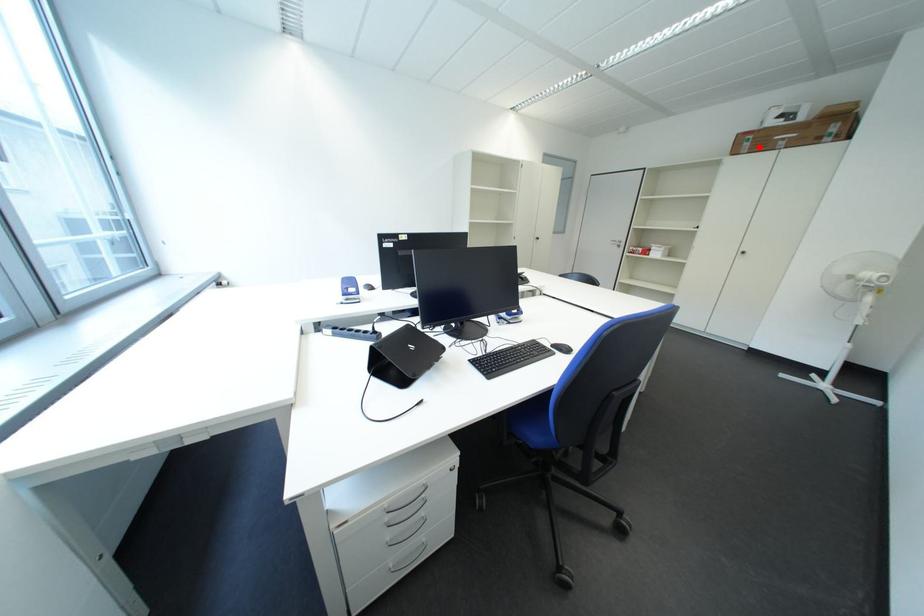
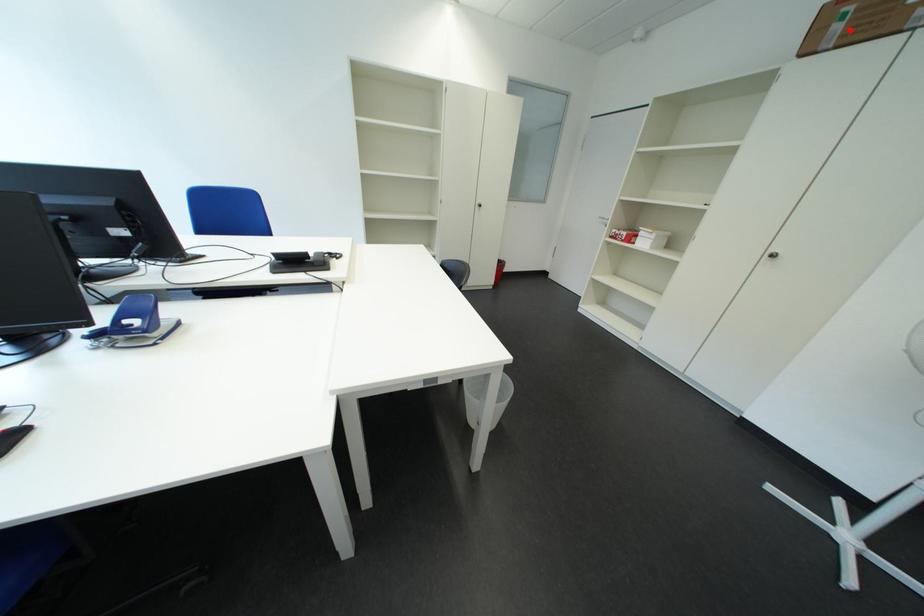
I am providing you with two images of the same scene from different viewpoints. A red point is marked on the first image and another point is marked on the second image. Do the highlighted points in image1 and image2 indicate the same real-world spot?

Yes